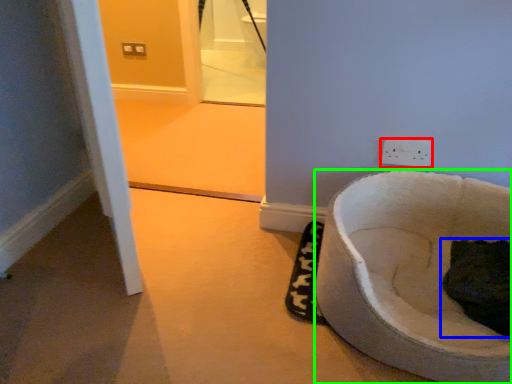
Question: Which is farther away from power plugs and sockets (highlighted by a red box)? cat (highlighted by a blue box) or toilet (highlighted by a green box)?

Choices:
 (A) cat
 (B) toilet

Answer: (A)